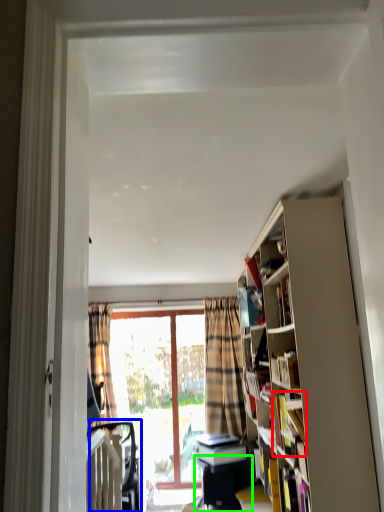
Question: Which is nearer to the book (highlighted by a red box)? swivel chair (highlighted by a blue box) or table (highlighted by a green box).

Choices:
 (A) swivel chair
 (B) table

Answer: (B)